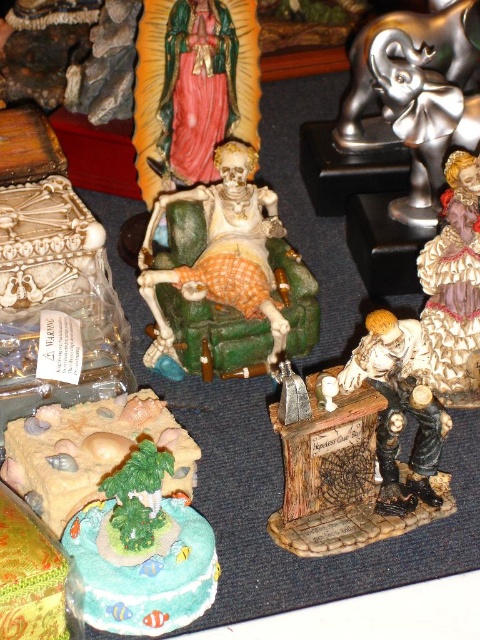
Which is behind, point (199, 204) or point (109, 525)?

The point (199, 204) is more distant.

Can you confirm if matte plastic skeleton at center is smaller than matte plastic island at lower left?

No.

Is point (275, 289) positioned before point (115, 538)?

No, it is behind (115, 538).

Where is `matte plastic skeleton at center`? Image resolution: width=480 pixels, height=640 pixels. matte plastic skeleton at center is located at coordinates (227, 273).

Find the location of `matte plastic skeleton at center`. matte plastic skeleton at center is located at coordinates (227, 273).

Is matte plastic skeleton at center to the right of matte porcelain figure at lower right from the viewer's perspective?

No, matte plastic skeleton at center is not to the right of matte porcelain figure at lower right.

Find the location of a particular element. The width and height of the screenshot is (480, 640). matte plastic skeleton at center is located at coordinates (227, 273).

This screenshot has height=640, width=480. Find the location of `matte plastic skeleton at center`. matte plastic skeleton at center is located at coordinates (227, 273).

Who is positioned more to the left, shiny silver elephant at upper right or matte porcelain figure at lower right?

From the viewer's perspective, matte porcelain figure at lower right appears more on the left side.

Between point (432, 209) and point (387, 499), which one is positioned behind?

Point (432, 209)

Is point (408, 74) closer to camera compared to point (396, 381)?

That is False.

The height and width of the screenshot is (640, 480). I want to click on shiny silver elephant at upper right, so click(415, 92).